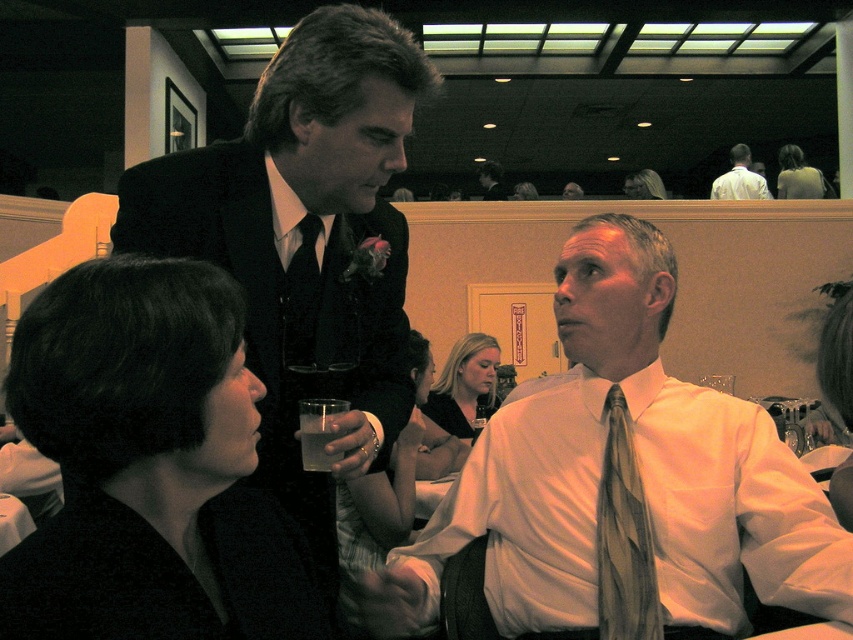
Question: Is white satin shirt at center smaller than matte black suit at upper center?

Choices:
 (A) no
 (B) yes

Answer: (A)

Question: Which of the following is the farthest from the observer?

Choices:
 (A) (302, 429)
 (B) (726, 198)
 (C) (489, 168)
 (D) (350, 364)

Answer: (C)

Question: Among these objects, which one is nearest to the camera?

Choices:
 (A) black fabric at upper left
 (B) matte black suit at upper center
 (C) white satin shirt at center

Answer: (A)

Question: Can you confirm if silky beige tie at center is wider than matte black suit at upper center?

Choices:
 (A) yes
 (B) no

Answer: (B)

Question: In this image, where is black fabric at upper left located relative to translucent glass at lower center?

Choices:
 (A) left
 (B) right

Answer: (A)

Question: Which object appears closest to the camera in this image?

Choices:
 (A) black fabric at upper left
 (B) white silk shirt at upper center

Answer: (A)